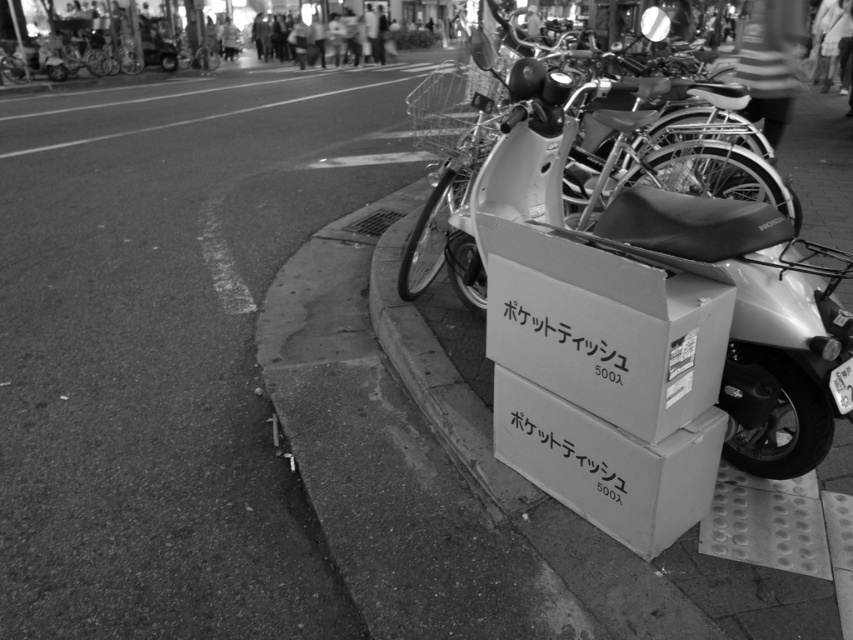
You are standing at the street corner and want to take a photo of the parked scooter with the box on its rear rack. If you position yourself so that both points, point 1 at point (643, 161) and point 2 at point (537, 444), are visible in your camera frame, which point will appear closer to the center of your photo?

Point 2 at point (537, 444) will appear closer to the center of your photo because it is closer to the camera than point 1 at point (643, 161).

Looking at this image, you are standing at the point marked as point (x=605, y=326). You want to place a new box exactly where the cardboard box at center is currently located. Is this possible?

The cardboard box at center is already located at point (x=605, y=326), so placing another box there would not be possible without removing the existing one.

You are a delivery person who needs to load a package onto the white matte motorcycle at center. The package is the same size as the white cardboard box at lower right. Can you place the package on the motorcycle without moving the box?

The white matte motorcycle at center is 33.39 inches away from the white cardboard box at lower right. Since the distance between them is more than enough to place the package on the motorcycle without moving the box, the answer is yes.